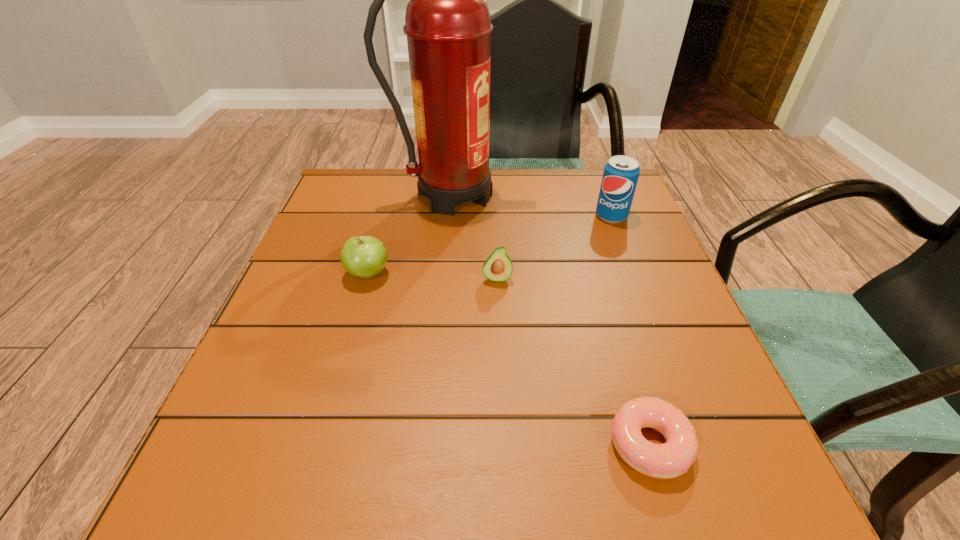
At what (x,y) coordinates should I click in order to perform the action: click on free space between the shortest object and the tallest object. Please return your answer as a coordinate pair (x, y). Looking at the image, I should click on (550, 320).

Where is `vacant area between the fire extinguisher and the nearest object`? This screenshot has width=960, height=540. vacant area between the fire extinguisher and the nearest object is located at coordinates (550, 320).

Image resolution: width=960 pixels, height=540 pixels. I want to click on free space that is in between the avocado and the soda can, so click(x=554, y=247).

You are a GUI agent. You are given a task and a screenshot of the screen. Output one action in this format:
    pyautogui.click(x=<x>, y=<y>)
    Task: Click on the vacant space in between the nearest object and the soda can
    This screenshot has height=540, width=960.
    Given the screenshot: What is the action you would take?
    pyautogui.click(x=631, y=330)

Where is `free spot between the fire extinguisher and the second tallest object`? This screenshot has width=960, height=540. free spot between the fire extinguisher and the second tallest object is located at coordinates tap(531, 206).

The width and height of the screenshot is (960, 540). In order to click on free space between the avocado and the fourth shortest object in this screenshot , I will do `click(554, 247)`.

Find the location of a particular element. Image resolution: width=960 pixels, height=540 pixels. vacant area that lies between the soda can and the apple is located at coordinates coord(490,245).

The height and width of the screenshot is (540, 960). I want to click on empty space between the apple and the second tallest object, so click(490, 245).

I want to click on object that can be found as the second closest to the fourth shortest object, so click(498, 267).

Locate an element on the screen. object that can be found as the closest to the soda can is located at coordinates (448, 26).